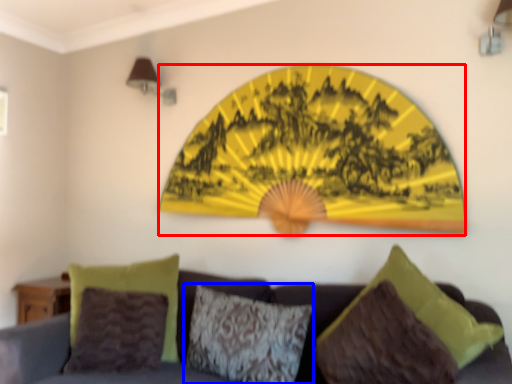
Question: Which point is closer to the camera, design (highlighted by a red box) or pillow (highlighted by a blue box)?

Choices:
 (A) design
 (B) pillow

Answer: (B)